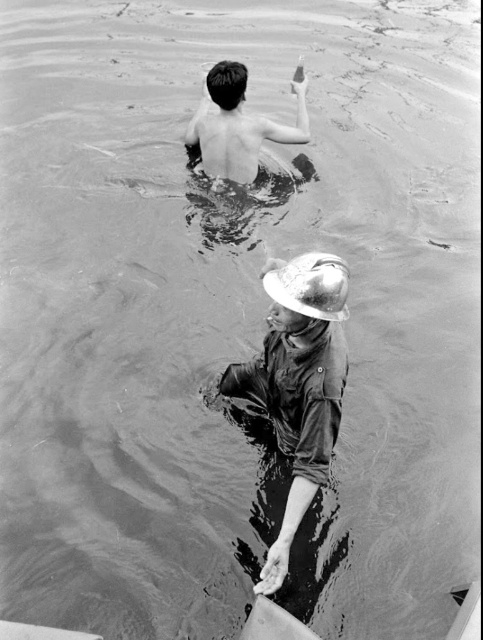
Can you confirm if shiny metallic helmet at center is bigger than shiny skin at upper center?

Actually, shiny metallic helmet at center might be smaller than shiny skin at upper center.

Consider the image. Can you confirm if shiny metallic helmet at center is positioned to the left of shiny skin at upper center?

In fact, shiny metallic helmet at center is to the right of shiny skin at upper center.

The image size is (483, 640). Describe the element at coordinates (298, 381) in the screenshot. I see `shiny metallic helmet at center` at that location.

The height and width of the screenshot is (640, 483). I want to click on shiny metallic helmet at center, so click(x=298, y=381).